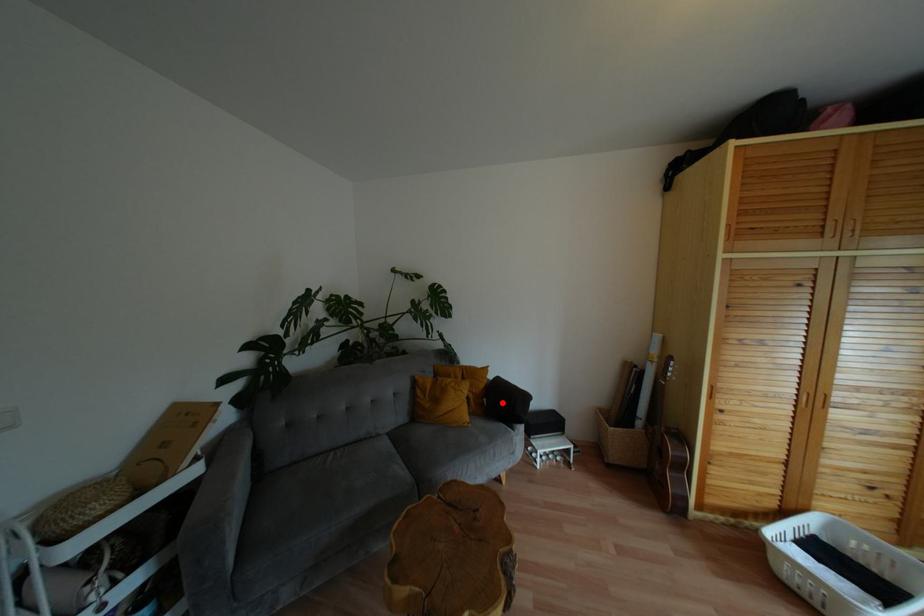
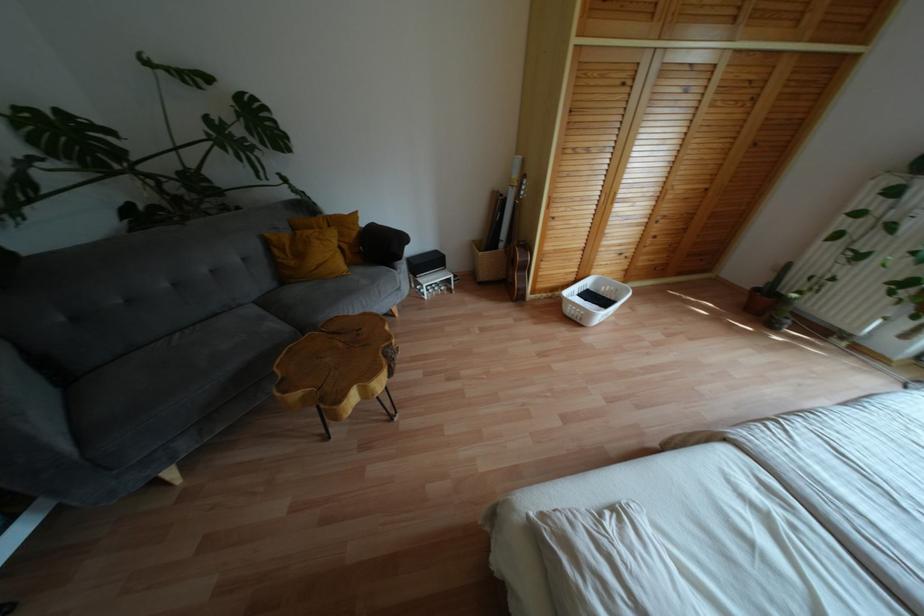
Question: I am providing you with two images of the same scene from different viewpoints. In image1, a red point is highlighted. Considering the same 3D point in image2, which of the following is correct?

Choices:
 (A) It is closer
 (B) It is farther

Answer: (A)